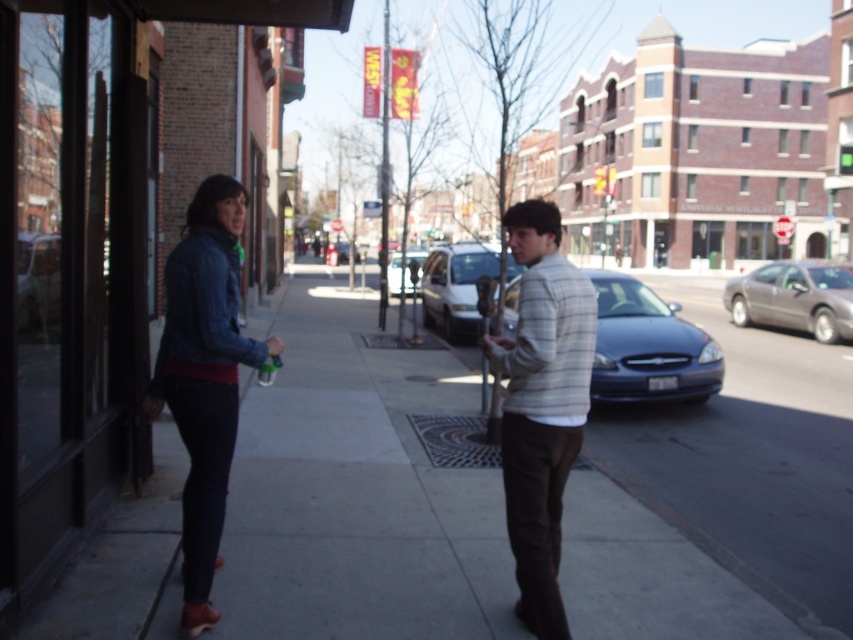
Is denim jacket at left further to the viewer compared to matte blue sedan at center?

That is False.

In the scene shown: Who is higher up, denim jacket at left or matte blue sedan at center?

matte blue sedan at center is above.

This screenshot has width=853, height=640. Describe the element at coordinates (204, 376) in the screenshot. I see `denim jacket at left` at that location.

The height and width of the screenshot is (640, 853). What are the coordinates of `denim jacket at left` in the screenshot? It's located at (204, 376).

Between gray concrete sidewalk at center and denim jacket at center, which one is positioned lower?

gray concrete sidewalk at center is lower down.

Which is behind, point (163, 596) or point (305, 422)?

Positioned behind is point (305, 422).

The image size is (853, 640). What do you see at coordinates (357, 490) in the screenshot?
I see `gray concrete sidewalk at center` at bounding box center [357, 490].

The height and width of the screenshot is (640, 853). Find the location of `gray concrete sidewalk at center`. gray concrete sidewalk at center is located at coordinates (357, 490).

Can you confirm if denim jacket at center is thinner than white matte van at center?

A: Incorrect, denim jacket at center's width is not less than white matte van at center's.

Who is lower down, denim jacket at center or white matte van at center?

Positioned lower is denim jacket at center.

Who is more forward, (306, 385) or (465, 310)?

Positioned in front is point (306, 385).

The width and height of the screenshot is (853, 640). I want to click on denim jacket at center, so click(357, 490).